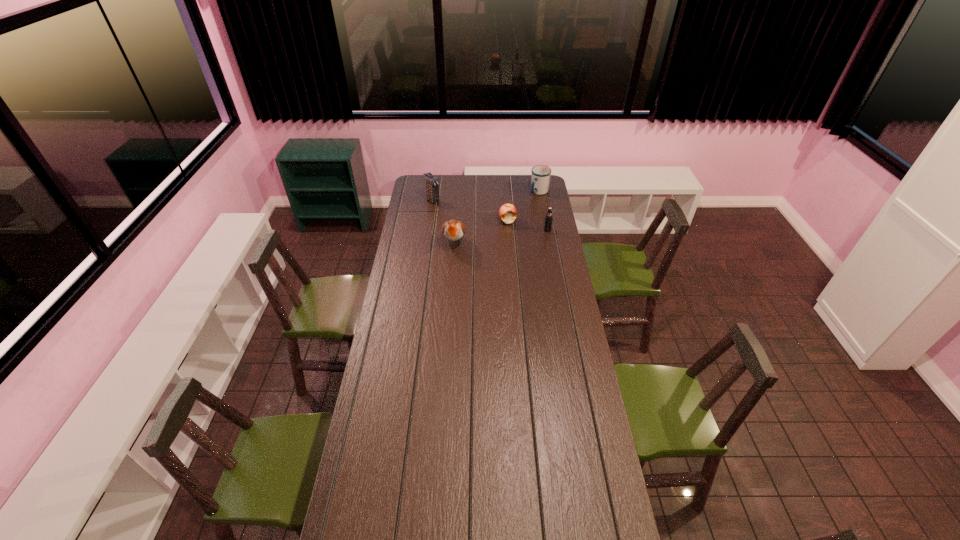
What are the coordinates of `vacant space on the desktop that is between the second object from left to right and the pop and is positioned on the handle side of the mug` in the screenshot? It's located at (503, 236).

In order to click on free space on the desktop that is between the bird and the pop and is positioned on the bitten side of the third farthest object in this screenshot , I will do `click(489, 238)`.

You are a GUI agent. You are given a task and a screenshot of the screen. Output one action in this format:
    pyautogui.click(x=<x>, y=<y>)
    Task: Click on the vacant spot on the desktop that is between the bird and the pop and is positioned with the zip open on the leftmost object
    
    Given the screenshot: What is the action you would take?
    pyautogui.click(x=490, y=238)